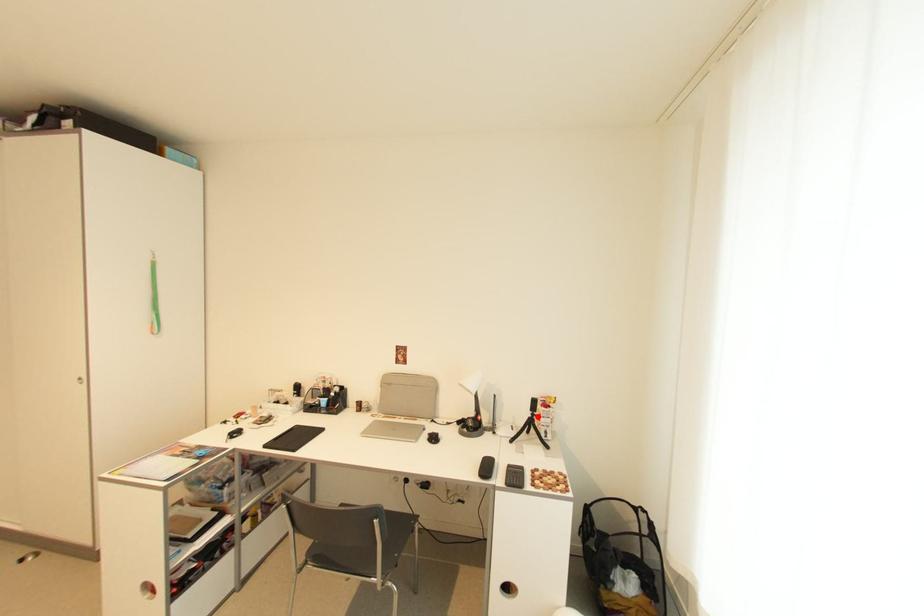
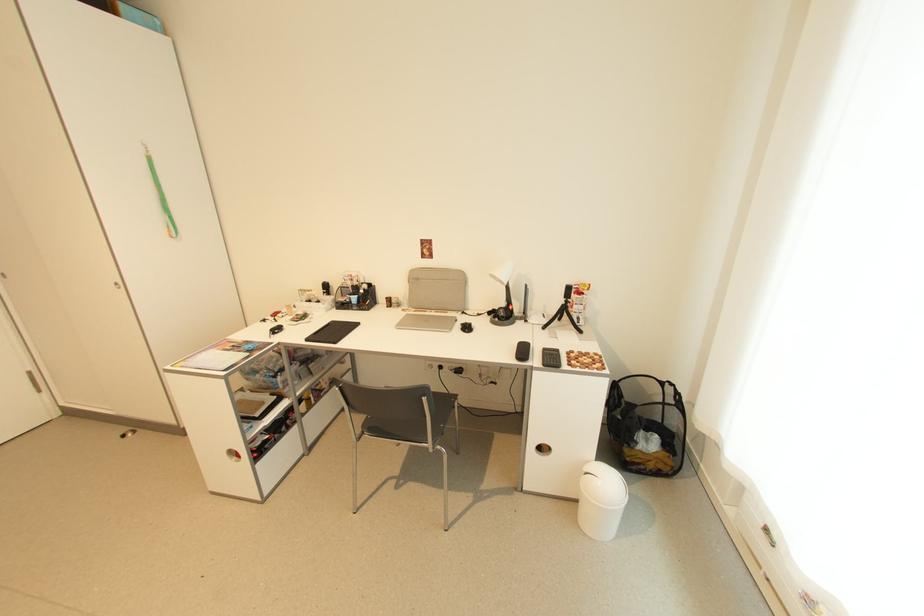
In the second image, find the point that corresponds to the highlighted location in the first image.

(572, 302)